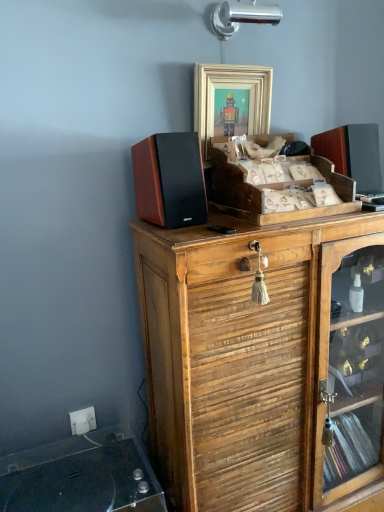
Question: From their relative heights in the image, would you say white plastic electric outlet at lower left is taller or shorter than gold-toned wooden frame at upper center?

Choices:
 (A) short
 (B) tall

Answer: (A)

Question: Is white plastic electric outlet at lower left bigger or smaller than gold-toned wooden frame at upper center?

Choices:
 (A) big
 (B) small

Answer: (B)

Question: Considering the real-world distances, which object is farthest from the wooden cabinet at upper center, which ranks as the 2th cabinetry in top-to-bottom order?

Choices:
 (A) wooden crate at center, placed as the first cabinetry when sorted from top to bottom
 (B) clear glass record player at lower left
 (C) white plastic electric outlet at lower left
 (D) gold-toned wooden frame at upper center

Answer: (C)

Question: Which object is the closest to the wooden crate at center, placed as the first cabinetry when sorted from top to bottom?

Choices:
 (A) gold-toned wooden frame at upper center
 (B) white plastic electric outlet at lower left
 (C) wooden cabinet at upper center, which ranks as the 2th cabinetry in top-to-bottom order
 (D) clear glass record player at lower left

Answer: (A)